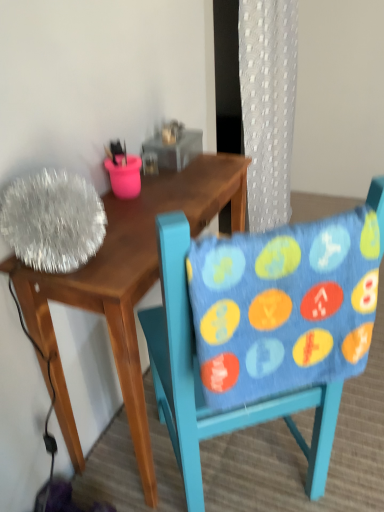
Question: Visually, is blue fabric chair at center positioned to the left or to the right of wooden desk at left?

Choices:
 (A) left
 (B) right

Answer: (B)

Question: Which is correct: blue fabric chair at center is inside wooden desk at left, or outside of it?

Choices:
 (A) inside
 (B) outside

Answer: (B)

Question: Considering the real-world distances, which object is closest to the blue fabric chair at center?

Choices:
 (A) wooden desk at left
 (B) blue fabric pillow at center

Answer: (B)

Question: Estimate the real-world distances between objects in this image. Which object is closer to the blue fabric chair at center?

Choices:
 (A) wooden desk at left
 (B) blue fabric pillow at center

Answer: (B)